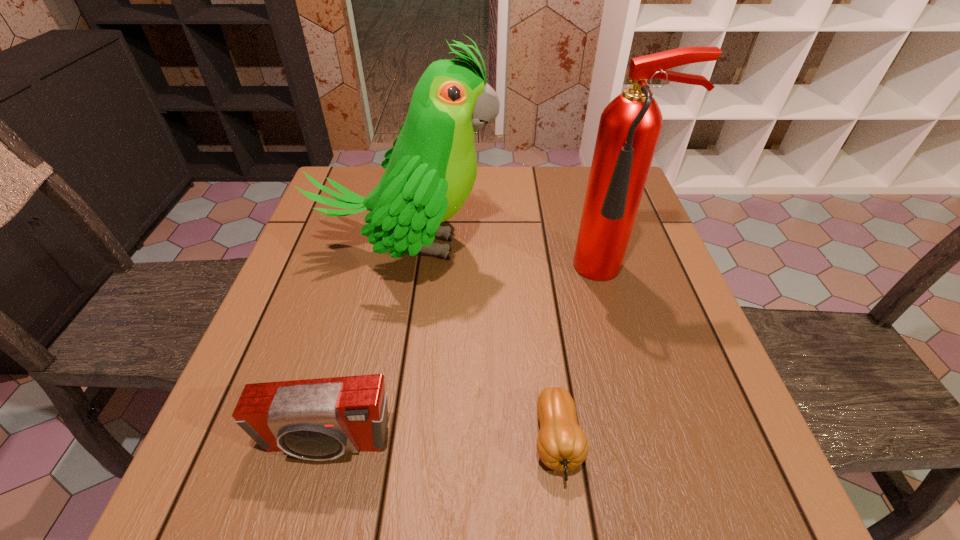
The height and width of the screenshot is (540, 960). Find the location of `parakeet`. parakeet is located at coordinates (430, 171).

I want to click on the rightmost object, so click(x=630, y=125).

I want to click on the second shortest object, so click(x=321, y=419).

What are the coordinates of `the shortest object` in the screenshot? It's located at (562, 445).

Where is `the second object from right to left`? This screenshot has height=540, width=960. the second object from right to left is located at coordinates (562, 445).

I want to click on vacant space positioned 0.150m on the beak of the parakeet, so click(558, 247).

I want to click on vacant region located 0.240m at the nozzle of the rightmost object, so coord(652,393).

The height and width of the screenshot is (540, 960). Identify the location of object that is positioned at the far edge. (430, 171).

At what (x,y) coordinates should I click in order to perform the action: click on camera that is at the near edge. Please return your answer as a coordinate pair (x, y). The width and height of the screenshot is (960, 540). Looking at the image, I should click on (321, 419).

Identify the location of gourd that is at the near edge. (562, 445).